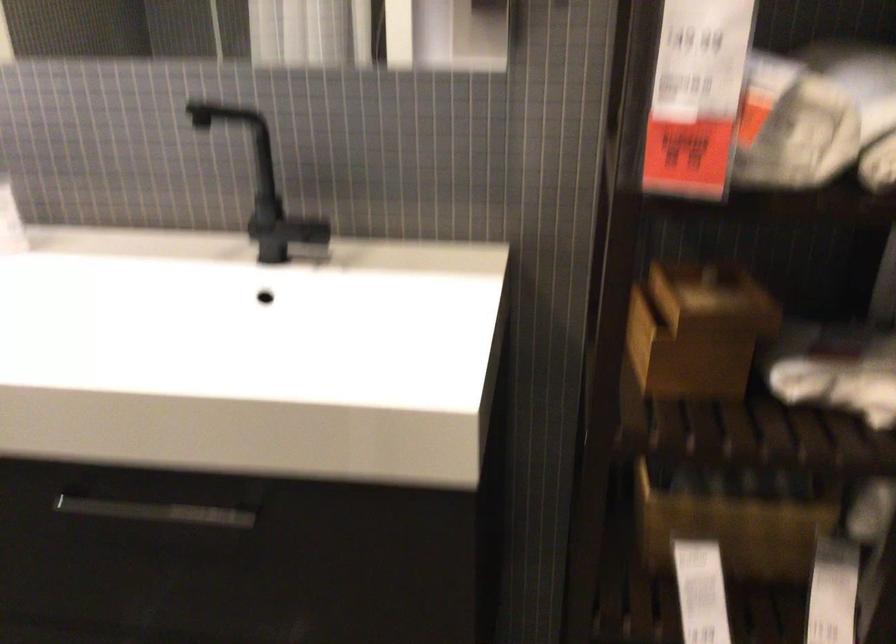
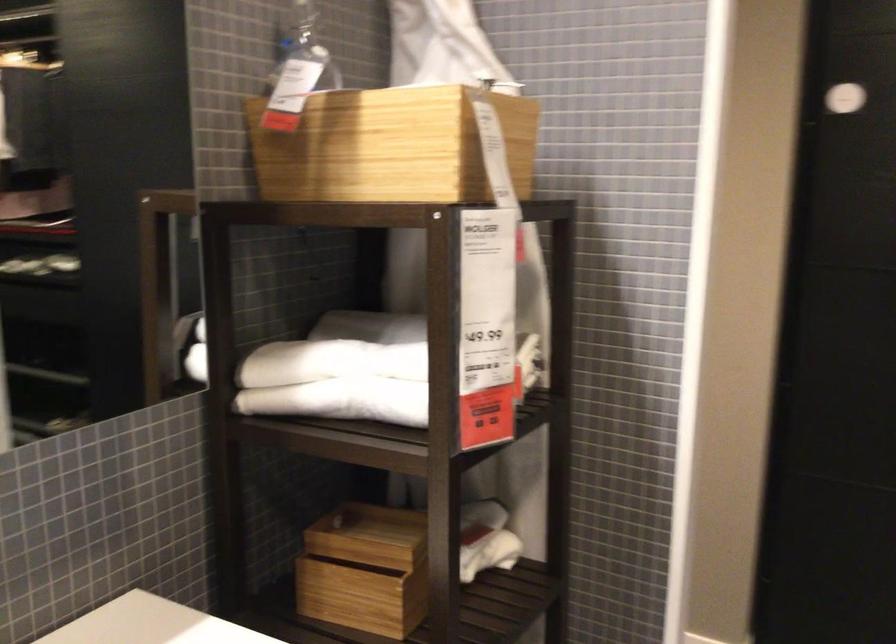
Find the pixel in the second image that matches (x=667, y=118) in the first image.

(341, 401)